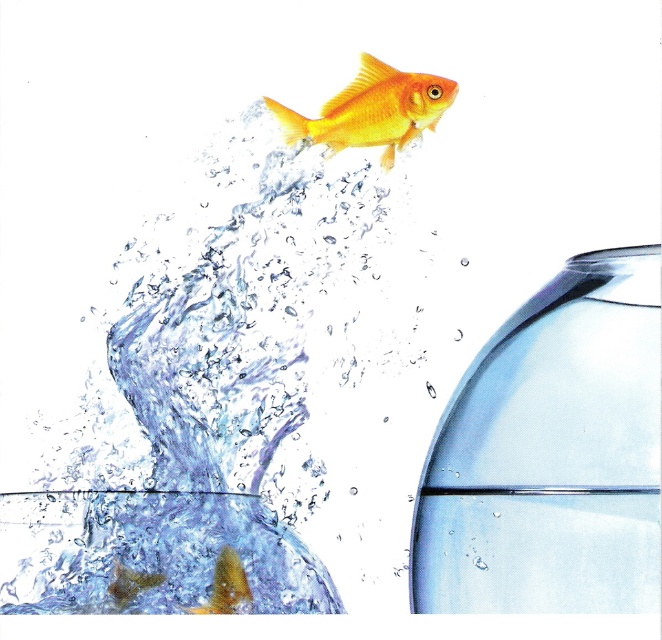
Question: Among these objects, which one is farthest from the camera?

Choices:
 (A) translucent glass water at upper center
 (B) shiny gold fish at upper center

Answer: (B)

Question: Can you confirm if translucent glass water at upper center is bigger than shiny gold fish at upper center?

Choices:
 (A) yes
 (B) no

Answer: (A)

Question: Which point is closer to the camera taking this photo?

Choices:
 (A) (410, 97)
 (B) (250, 467)

Answer: (B)

Question: Can you confirm if translucent glass water at upper center is positioned to the right of shiny gold fish at upper center?

Choices:
 (A) yes
 (B) no

Answer: (B)

Question: Can you confirm if translucent glass water at upper center is bigger than shiny gold fish at upper center?

Choices:
 (A) yes
 (B) no

Answer: (A)